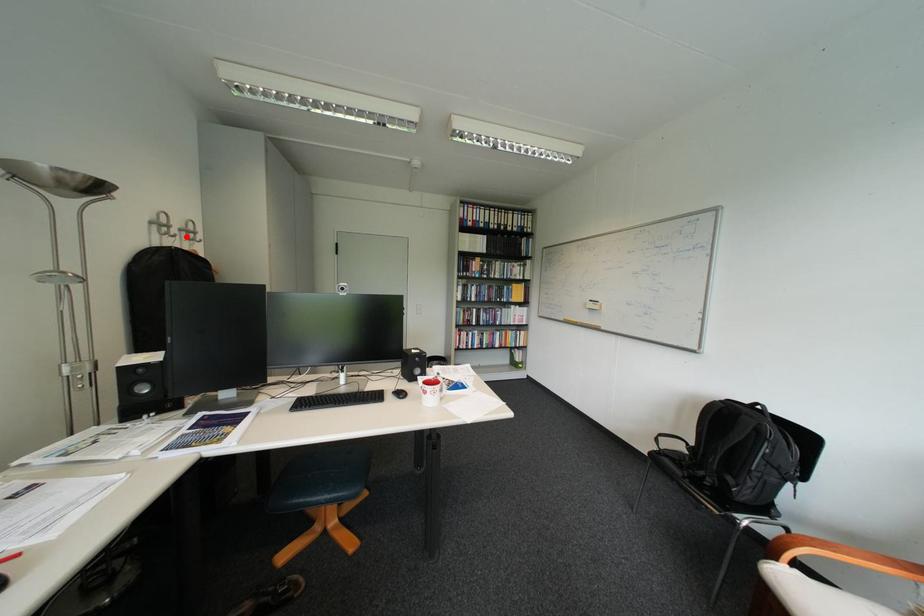
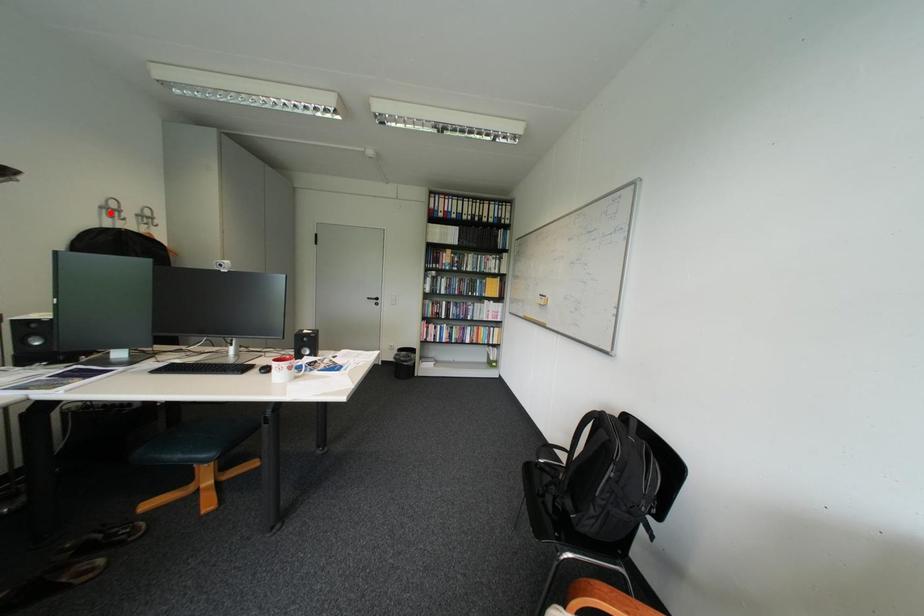
I am providing you with two images of the same scene from different viewpoints. A red point is marked on the first image and another point is marked on the second image. Does the point marked in image1 correspond to the same location as the one in image2?

No